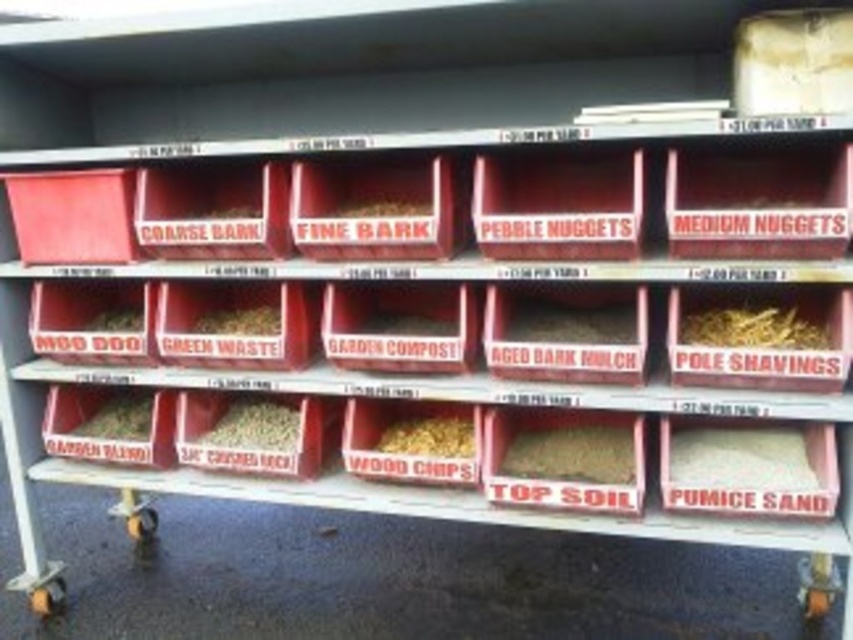
You are standing in front of the shelving unit and want to reach two points marked on the shelves. Which point, point at (132, 432) or point at (207, 330), is closer to you?

Point at (132, 432) is closer to you because it is further to the viewer than point at (207, 330).

You are organizing the shelves and need to know which item is taller between the brown wood chips at center and the green waste at center. Can you tell me which one is taller?

The brown wood chips at center is taller than the green waste at center.